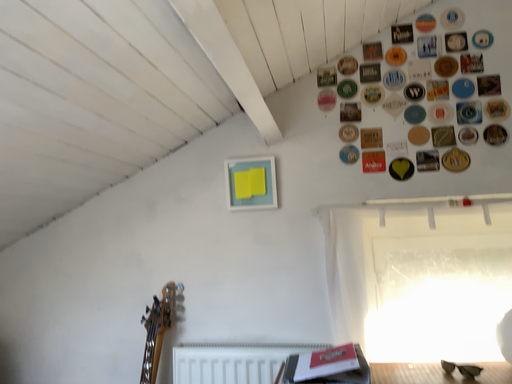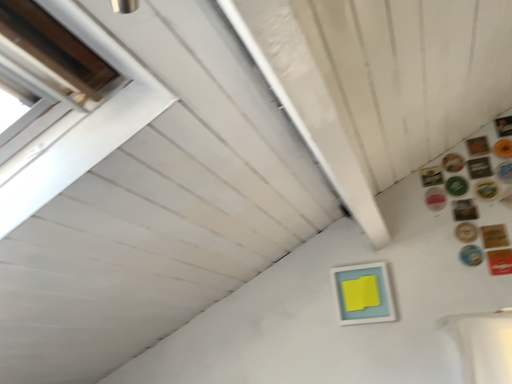
Question: How did the camera likely rotate when shooting the video?

Choices:
 (A) rotated right
 (B) rotated left

Answer: (B)